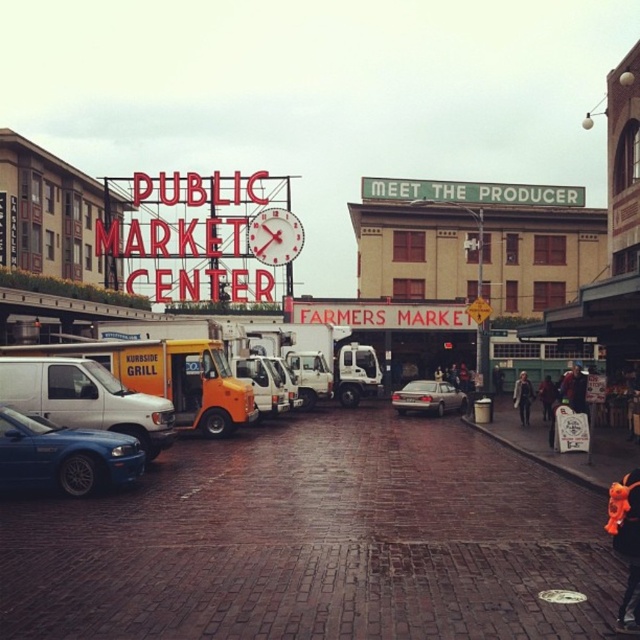
Question: Does red leather jacket at center appear on the right side of light brown leather jacket at center?

Choices:
 (A) no
 (B) yes

Answer: (B)

Question: Which point is closer to the camera?

Choices:
 (A) (406, 406)
 (B) (634, 550)

Answer: (B)

Question: Does yellow matte food truck at center appear under dark blue jeans at center?

Choices:
 (A) yes
 (B) no

Answer: (B)

Question: Can you confirm if white matte van at left is thinner than yellow matte truck at center?

Choices:
 (A) yes
 (B) no

Answer: (A)

Question: Which of the following is the farthest from the observer?

Choices:
 (A) white matte van at left
 (B) metallic blue sedan at lower left
 (C) white plastic clock at center

Answer: (C)

Question: Which object appears farthest from the camera in this image?

Choices:
 (A) red leather jacket at center
 (B) orange plush toy at lower right
 (C) yellow matte food truck at center
 (D) light brown leather jacket at center

Answer: (D)